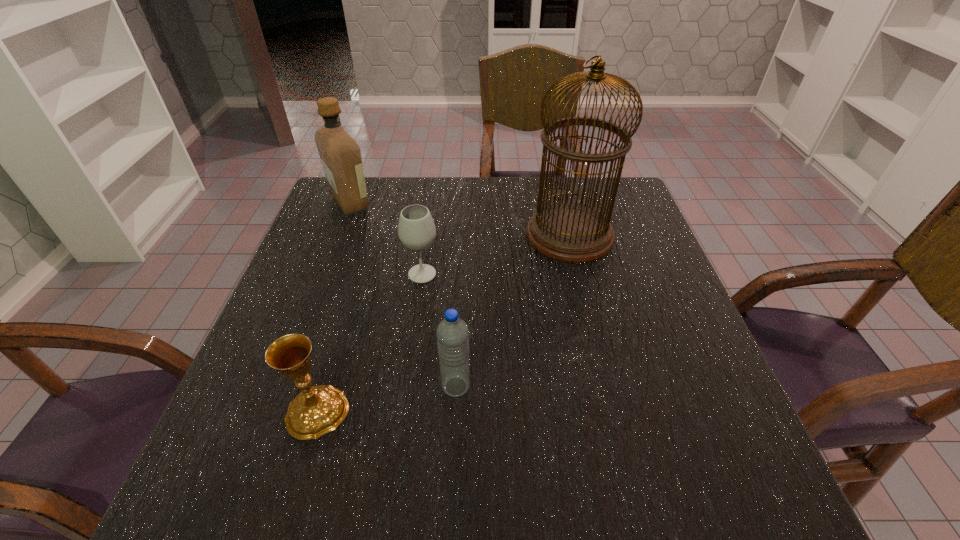
You are a GUI agent. You are given a task and a screenshot of the screen. Output one action in this format:
    pyautogui.click(x=<x>, y=<y>)
    Task: Click on the tallest object
    The image size is (960, 540).
    Given the screenshot: What is the action you would take?
    pyautogui.click(x=572, y=232)

Identify the location of the rightmost object. The height and width of the screenshot is (540, 960). (572, 232).

Find the location of a particular element. This screenshot has height=540, width=960. liquor is located at coordinates (340, 154).

Find the location of a particular element. This screenshot has height=540, width=960. water bottle is located at coordinates (452, 333).

Identify the location of wineglass. The image size is (960, 540). point(416,229).

Where is `chalice`? chalice is located at coordinates (316, 410).

The image size is (960, 540). In order to click on free space located on the front-facing side of the rightmost object in this screenshot , I will do `click(397, 235)`.

Locate an element on the screen. This screenshot has width=960, height=540. free point located on the front-facing side of the rightmost object is located at coordinates (454, 235).

This screenshot has width=960, height=540. In order to click on free region located on the front-facing side of the rightmost object in this screenshot , I will do `click(481, 235)`.

Locate an element on the screen. The height and width of the screenshot is (540, 960). vacant area situated on the front-facing side of the liquor is located at coordinates (498, 203).